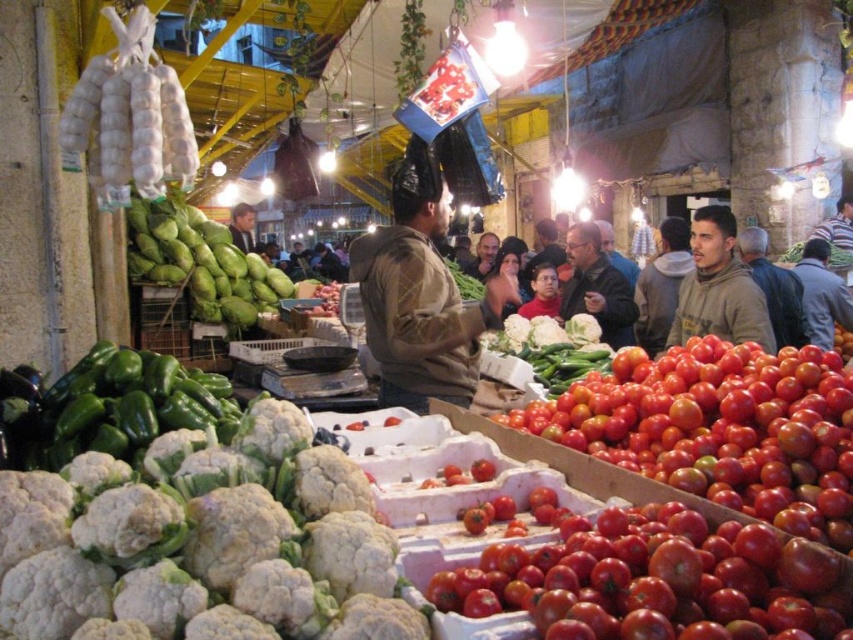
You are standing at the entrance of the market and see the point marked at coordinates (718, 288). What object is located at that point?

The point at coordinates (718, 288) indicates the brown fuzzy hoodie at upper right.

You are a customer at the market and see two jackets displayed at the center. Which one is positioned lower between the brown leather jacket at center and the smooth brown jacket at center?

The brown leather jacket at center is positioned lower than the smooth brown jacket at center.

You are a customer at the market and want to buy both the red matte tomatoes at center and the brown textured jacket at center. Which item is located to the left of the other?

The brown textured jacket at center is to the left of the red matte tomatoes at center because the red matte tomatoes at center is positioned on the right side of brown textured jacket at center.